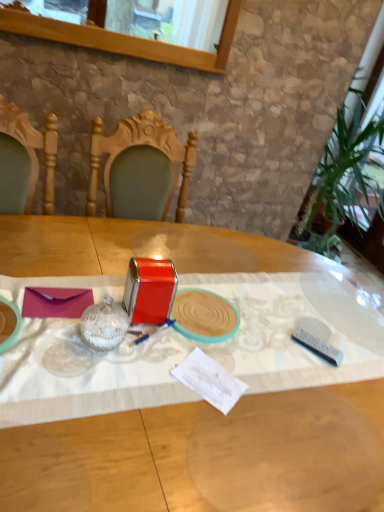
Locate an element on the screen. This screenshot has width=384, height=512. spots to the right of clear glass jar at center, acting as the 4th tableware starting from the right is located at coordinates (156, 365).